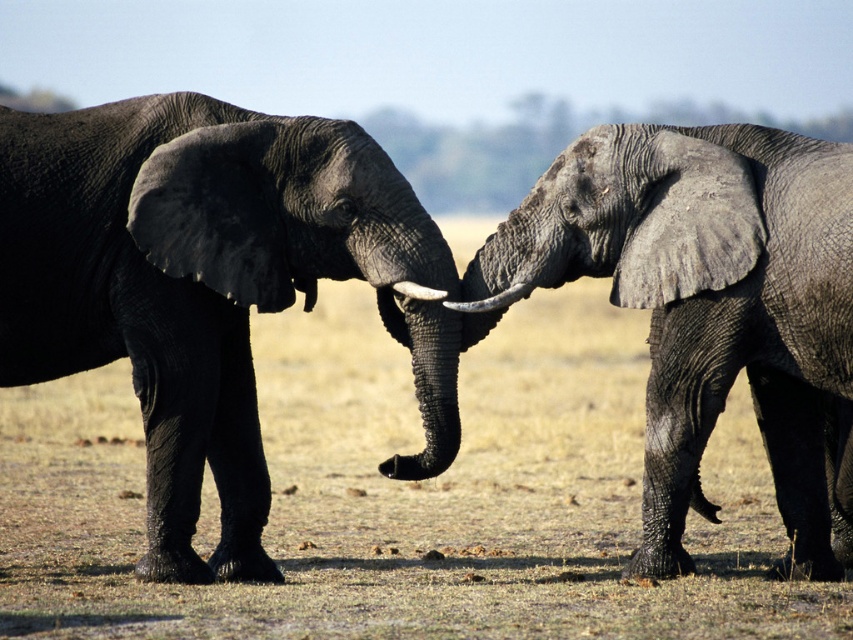
Question: Does gray rough elephant at right have a smaller size compared to white smooth tusk at center?

Choices:
 (A) no
 (B) yes

Answer: (A)

Question: Is brown dry grass at center further to the viewer compared to gray rough elephant at right?

Choices:
 (A) yes
 (B) no

Answer: (B)

Question: Which object is farther from the camera taking this photo?

Choices:
 (A) gray rough elephant at right
 (B) gray textured elephant at left

Answer: (B)

Question: Which point is farther to the camera?

Choices:
 (A) gray rough elephant at right
 (B) brown dry grass at center
 (C) gray textured elephant at left
 (D) white glossy tusk at center

Answer: (D)

Question: Is gray textured elephant at left bigger than white smooth tusk at center?

Choices:
 (A) yes
 (B) no

Answer: (A)

Question: Which point is farther to the camera?

Choices:
 (A) brown dry grass at center
 (B) gray rough elephant at right
 (C) white smooth tusk at center

Answer: (C)